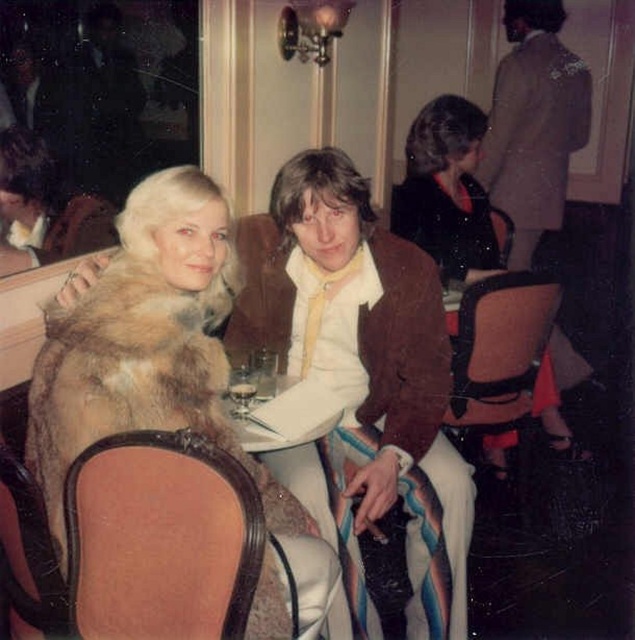
Question: Does fur coat at left have a smaller size compared to brown leather jacket at center?

Choices:
 (A) no
 (B) yes

Answer: (B)

Question: Is brown leather jacket at center to the left of brown leather chair at center from the viewer's perspective?

Choices:
 (A) no
 (B) yes

Answer: (A)

Question: Is brown leather chair at lower left bigger than velvet black dress at center?

Choices:
 (A) yes
 (B) no

Answer: (B)

Question: Which point is closer to the camera taking this photo?

Choices:
 (A) (149, 317)
 (B) (429, 161)

Answer: (A)

Question: Based on their relative distances, which object is farther from the brown leather jacket at center?

Choices:
 (A) velvet black dress at center
 (B) brown leather chair at center

Answer: (B)

Question: Estimate the real-world distances between objects in this image. Which object is closer to the fur coat at left?

Choices:
 (A) velvet black dress at center
 (B) brown leather chair at center

Answer: (B)